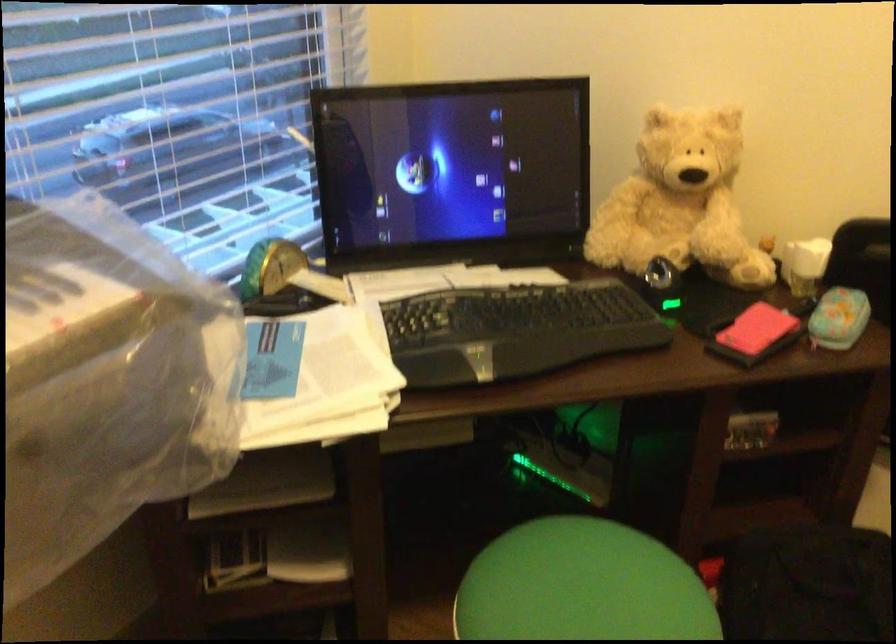
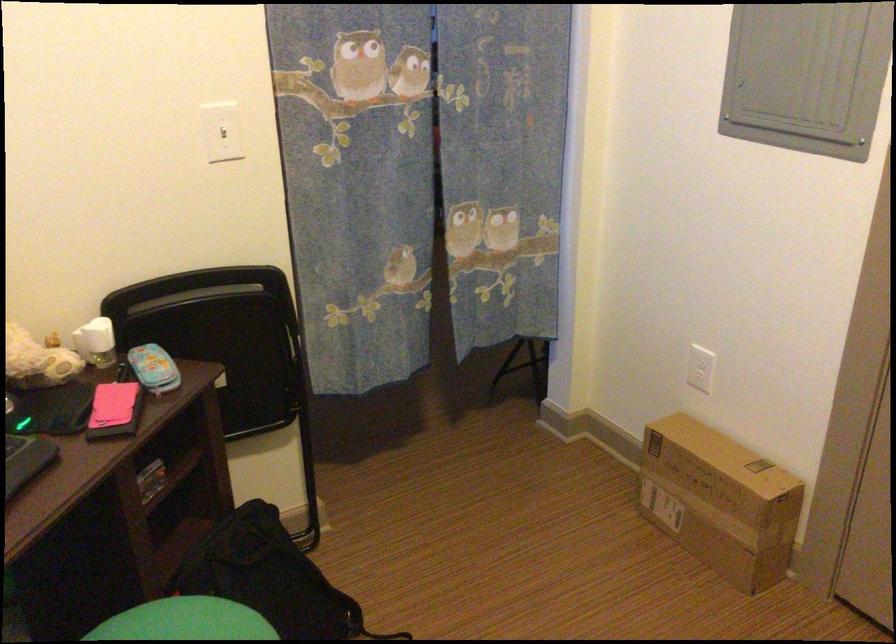
Find the pixel in the second image that matches the point at 754,335 in the first image.

(114, 410)